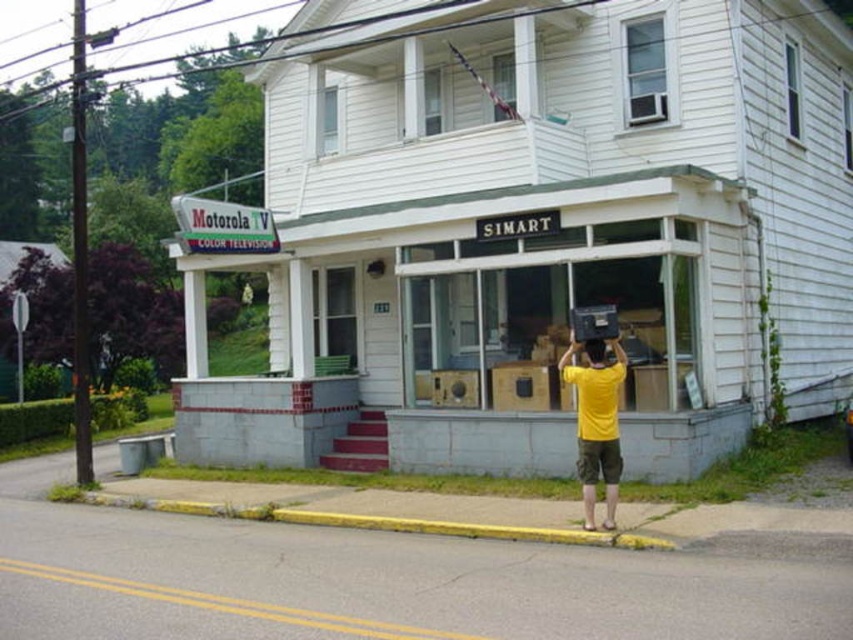
Question: Is white wood storefront at center positioned in front of yellow painted curb at lower center?

Choices:
 (A) no
 (B) yes

Answer: (A)

Question: Which object is positioned closest to the yellow matte shirt at center?

Choices:
 (A) yellow painted curb at lower center
 (B) white wood storefront at center

Answer: (A)

Question: Does white wood storefront at center come in front of yellow matte shirt at center?

Choices:
 (A) yes
 (B) no

Answer: (B)

Question: Among these objects, which one is farthest from the camera?

Choices:
 (A) yellow matte shirt at center
 (B) white wood storefront at center
 (C) yellow painted curb at lower center

Answer: (B)

Question: Which point is farther to the camera?

Choices:
 (A) (572, 378)
 (B) (820, 150)
 (C) (361, 524)

Answer: (B)

Question: Does yellow painted curb at lower center appear over yellow matte shirt at center?

Choices:
 (A) yes
 (B) no

Answer: (B)